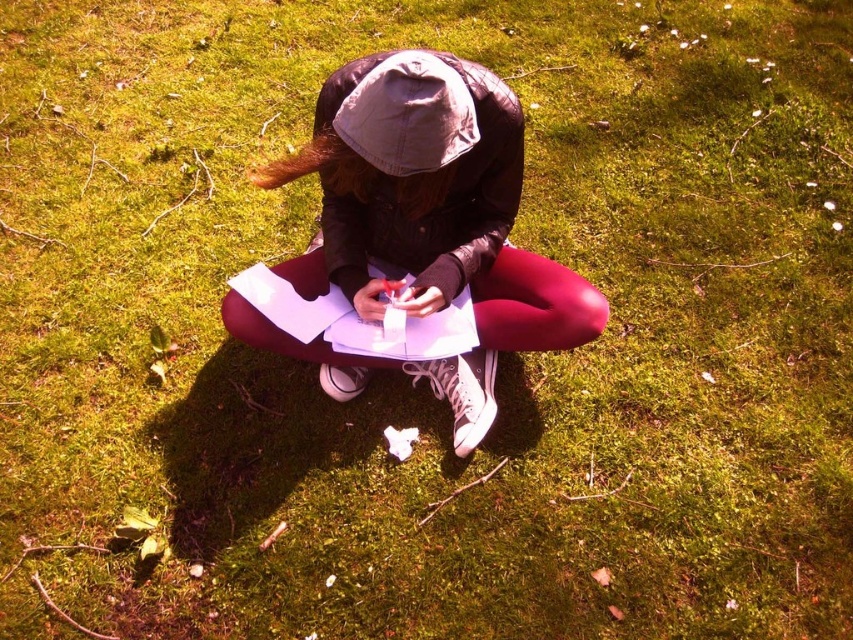
Question: Among these points, which one is farthest from the camera?

Choices:
 (A) (381, 134)
 (B) (544, 310)

Answer: (B)

Question: Which point appears closest to the camera in this image?

Choices:
 (A) (456, 365)
 (B) (351, 147)

Answer: (B)

Question: Is matte black jacket at center below light gray fabric hat at center?

Choices:
 (A) no
 (B) yes

Answer: (B)

Question: Which point is farther to the camera?

Choices:
 (A) light gray fabric hat at center
 (B) matte black jacket at center

Answer: (B)

Question: Is matte black jacket at center positioned at the back of light gray fabric hat at center?

Choices:
 (A) yes
 (B) no

Answer: (A)

Question: Does matte black jacket at center appear over light gray fabric hat at center?

Choices:
 (A) no
 (B) yes

Answer: (A)